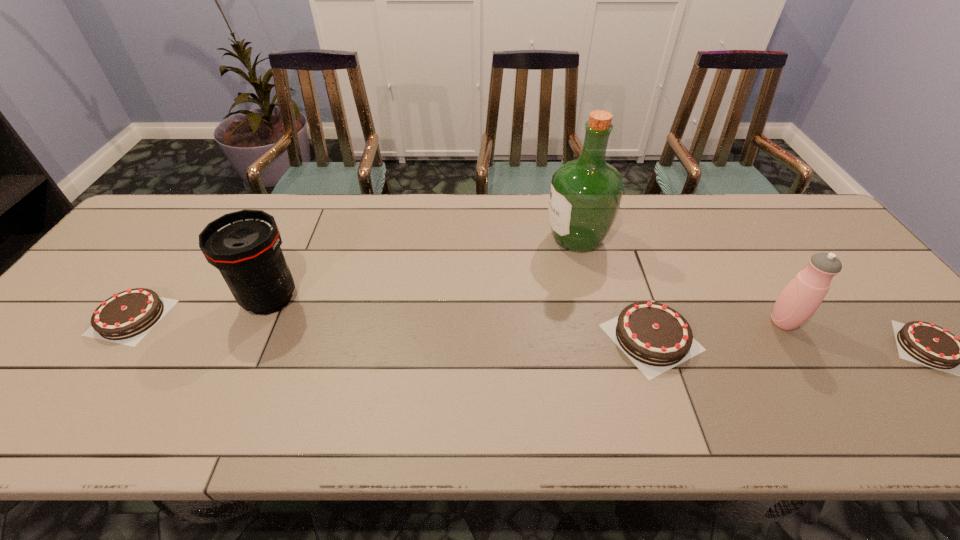
If the aim is uniform spacing by inserting an additional chocolate_cake among them, please point to a vacant space for this new chocolate_cake. Please provide its 2D coordinates. Your answer should be formatted as a tuple, i.e. [(x, y)], where the tuple contains the x and y coordinates of a point satisfying the conditions above.

[(386, 327)]